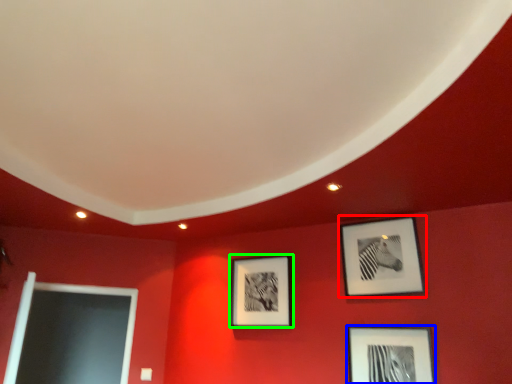
Question: Which is nearer to the picture frame (highlighted by a red box)? picture frame (highlighted by a blue box) or picture frame (highlighted by a green box).

Choices:
 (A) picture frame
 (B) picture frame

Answer: (A)